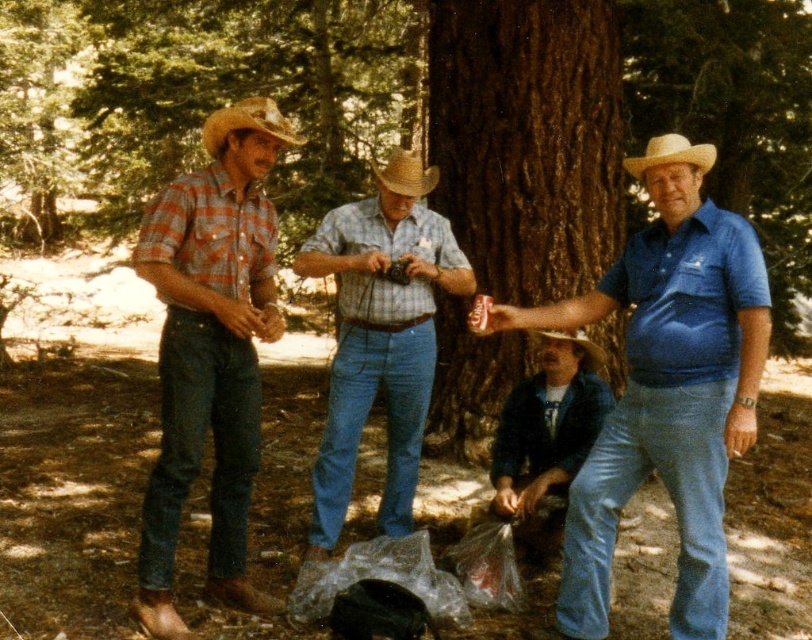
Can you confirm if denim jeans at center is positioned above blue denim jeans at lower center?

Yes, denim jeans at center is above blue denim jeans at lower center.

Is denim jeans at center wider than blue denim jeans at lower center?

Indeed, denim jeans at center has a greater width compared to blue denim jeans at lower center.

Between point (653, 374) and point (555, 513), which one is positioned behind?

Point (555, 513)

The image size is (812, 640). Find the location of `denim jeans at center`. denim jeans at center is located at coordinates (664, 396).

Does brown rough bark tree at center appear on the right side of light brown straw cowboy hat at right?

Incorrect, brown rough bark tree at center is not on the right side of light brown straw cowboy hat at right.

The width and height of the screenshot is (812, 640). I want to click on brown rough bark tree at center, so click(x=527, y=140).

I want to click on brown rough bark tree at center, so click(x=527, y=140).

Does brown rough bark tree at center appear on the right side of strawmaterial/texturecowboy hat at center?

Indeed, brown rough bark tree at center is positioned on the right side of strawmaterial/texturecowboy hat at center.

Which is in front, point (463, 307) or point (411, 188)?

Positioned in front is point (411, 188).

This screenshot has height=640, width=812. Find the location of `brown rough bark tree at center`. brown rough bark tree at center is located at coordinates (527, 140).